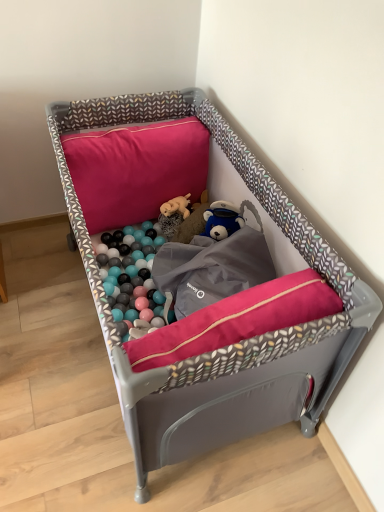
Question: Can you confirm if pink fabric pillow at upper center is positioned to the right of fluffy beige stuffed animal at center?

Choices:
 (A) no
 (B) yes

Answer: (A)

Question: Is pink fabric pillow at upper center positioned beyond the bounds of fluffy beige stuffed animal at center?

Choices:
 (A) no
 (B) yes

Answer: (B)

Question: Is fluffy beige stuffed animal at center at the back of pink fabric pillow at upper center?

Choices:
 (A) yes
 (B) no

Answer: (B)

Question: From the image's perspective, is pink fabric pillow at upper center on fluffy beige stuffed animal at center?

Choices:
 (A) yes
 (B) no

Answer: (A)

Question: Does pink fabric pillow at upper center have a lesser width compared to fluffy beige stuffed animal at center?

Choices:
 (A) no
 (B) yes

Answer: (A)

Question: Does pink fabric pillow at upper center have a larger size compared to fluffy beige stuffed animal at center?

Choices:
 (A) no
 (B) yes

Answer: (B)

Question: From the image's perspective, does matte gray playpen at center appear lower than fluffy beige stuffed animal at center?

Choices:
 (A) yes
 (B) no

Answer: (A)

Question: Is matte gray playpen at center positioned beyond the bounds of fluffy beige stuffed animal at center?

Choices:
 (A) no
 (B) yes

Answer: (B)

Question: Considering the relative sizes of matte gray playpen at center and fluffy beige stuffed animal at center in the image provided, is matte gray playpen at center smaller than fluffy beige stuffed animal at center?

Choices:
 (A) yes
 (B) no

Answer: (B)

Question: Is matte gray playpen at center wider than fluffy beige stuffed animal at center?

Choices:
 (A) yes
 (B) no

Answer: (A)

Question: Is matte gray playpen at center facing away from fluffy beige stuffed animal at center?

Choices:
 (A) no
 (B) yes

Answer: (B)

Question: Would you say fluffy beige stuffed animal at center is part of matte gray playpen at center's contents?

Choices:
 (A) no
 (B) yes

Answer: (B)

Question: From a real-world perspective, is fluffy beige stuffed animal at center positioned under pink fabric pillow at upper center based on gravity?

Choices:
 (A) yes
 (B) no

Answer: (A)